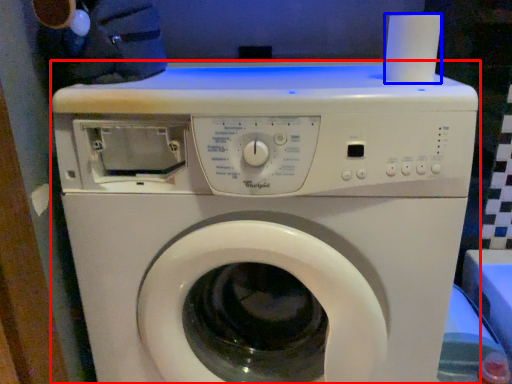
Question: Which of the following is the closest to the observer, washing machine (highlighted by a red box) or paper towel (highlighted by a blue box)?

Choices:
 (A) washing machine
 (B) paper towel

Answer: (A)